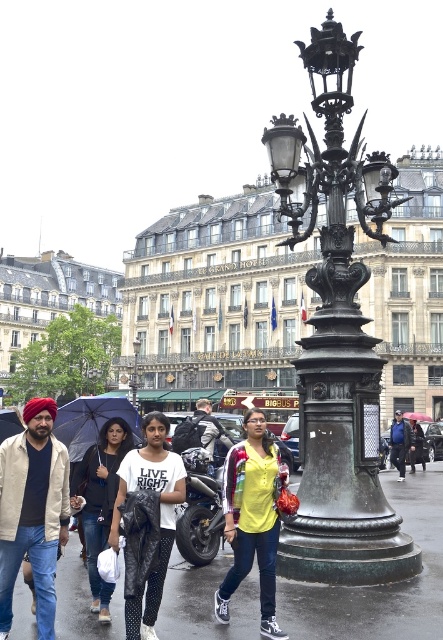
Question: Is shiny asphalt pavement at center further to the viewer compared to transparent plastic umbrella at center?

Choices:
 (A) no
 (B) yes

Answer: (A)

Question: Which object appears closest to the camera in this image?

Choices:
 (A) bronze/brass streetlamp at center
 (B) bronze ornate streetlamp at center

Answer: (A)

Question: Which point is farther to the camera?

Choices:
 (A) yellow fabric shirt at center
 (B) transparent plastic umbrella at center

Answer: (B)

Question: Is beige cotton jacket at lower left smaller than yellow fabric shirt at center?

Choices:
 (A) no
 (B) yes

Answer: (B)

Question: Does blue denim jacket at center have a smaller size compared to black matte umbrella at left?

Choices:
 (A) yes
 (B) no

Answer: (A)

Question: Among these points, which one is farthest from the camera?

Choices:
 (A) (221, 468)
 (B) (267, 444)
 (C) (138, 352)

Answer: (C)